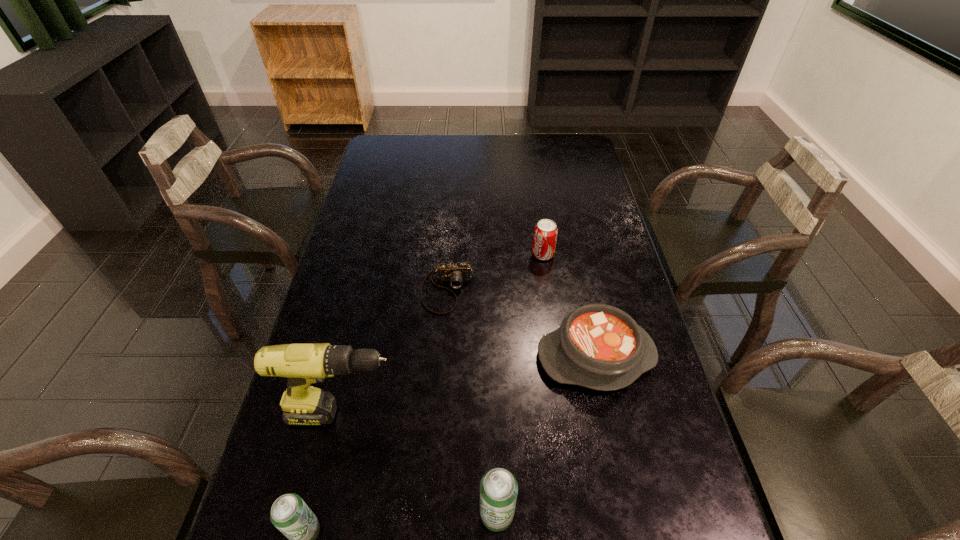
Where is `vacant space located on the right of the soda`? The height and width of the screenshot is (540, 960). vacant space located on the right of the soda is located at coordinates (595, 254).

At what (x,y) coordinates should I click in order to perform the action: click on vacant point located on the front-facing side of the shortest object. Please return your answer as a coordinate pair (x, y). Image resolution: width=960 pixels, height=540 pixels. Looking at the image, I should click on (436, 455).

The height and width of the screenshot is (540, 960). Identify the location of vacant space positioned on the left of the casserole. (467, 356).

Find the location of a particular element. This screenshot has height=540, width=960. free location located 0.100m on the handle side of the tallest object is located at coordinates (444, 414).

This screenshot has height=540, width=960. What are the coordinates of `object located in the near edge section of the desktop` in the screenshot? It's located at (498, 488).

Where is `object situated at the left edge`? object situated at the left edge is located at coordinates [303, 364].

Where is `object at the right edge`? The image size is (960, 540). object at the right edge is located at coordinates (598, 346).

I want to click on free space at the far edge of the desktop, so click(446, 152).

The width and height of the screenshot is (960, 540). I want to click on free space at the near edge of the desktop, so click(x=513, y=528).

Locate an element on the screen. This screenshot has height=540, width=960. vacant space at the left edge of the desktop is located at coordinates (331, 313).